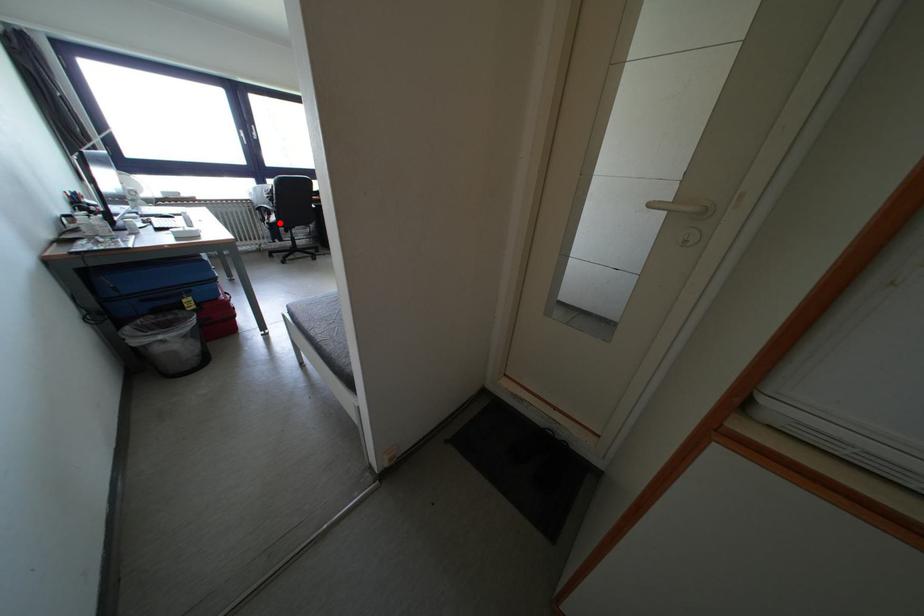
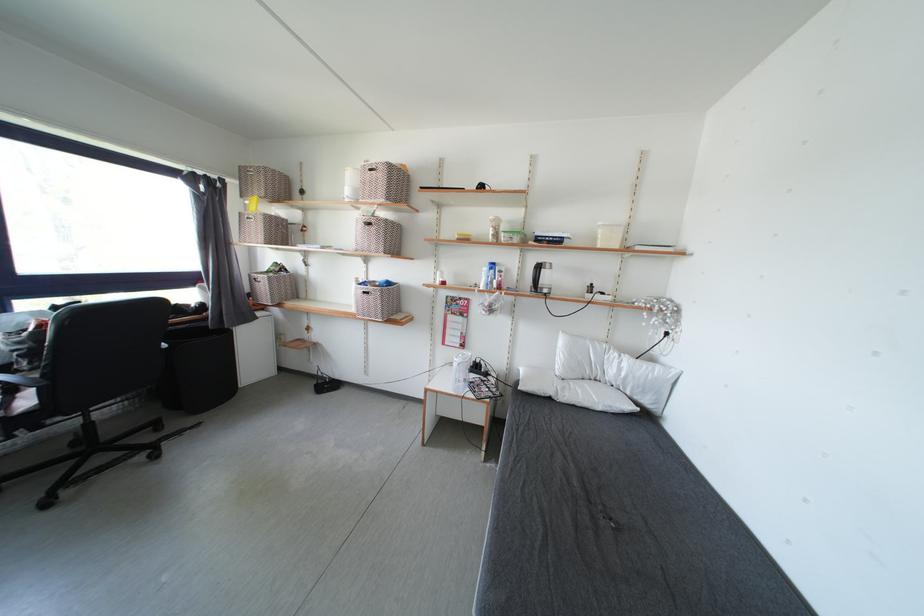
In the second image, find the point that corresponds to the highlighted location in the first image.

(33, 407)